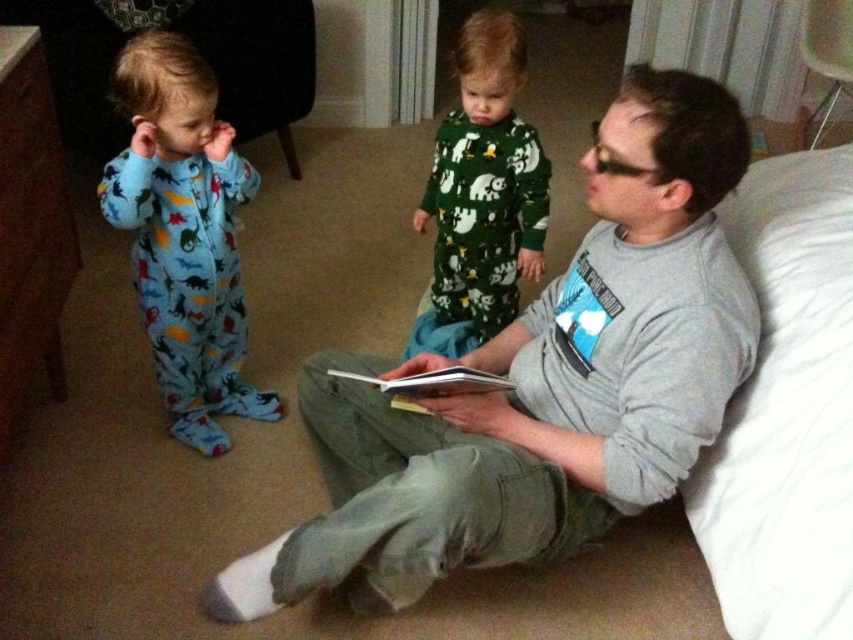
You are a tailor measuring clothing for a customer. You have a gray cotton shirt at center and a blue fleece onesie at left. Which garment has a greater width?

The gray cotton shirt at center has a greater width than the blue fleece onesie at left.

The man is sitting on the floor reading a book to two young children. The children are wearing colorful pajamas. The child on the left has a blue onesie with dinosaur prints, and the child on the right has a green onesie with animal motifs. There is a point at coordinates point [183,234]. Which child is closest to this point?

The point [183,234] corresponds to the blue fleece onesie at left, so the child on the left is closest to this point.